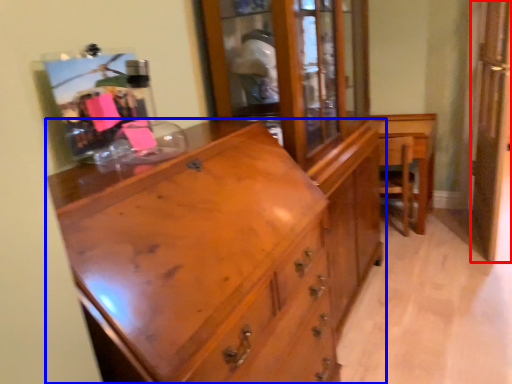
Question: Which object appears closest to the camera in this image, screen door (highlighted by a red box) or chest of drawers (highlighted by a blue box)?

Choices:
 (A) screen door
 (B) chest of drawers

Answer: (B)